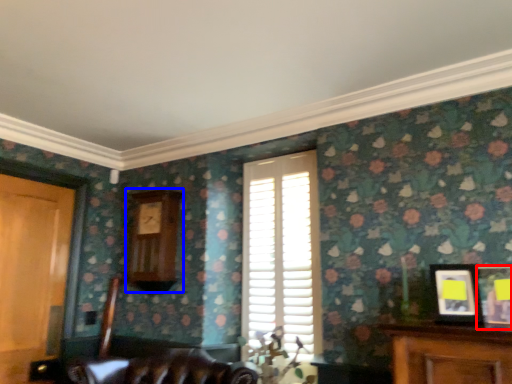
Question: Which point is closer to the camera, picture frame (highlighted by a red box) or clock (highlighted by a blue box)?

Choices:
 (A) picture frame
 (B) clock

Answer: (A)